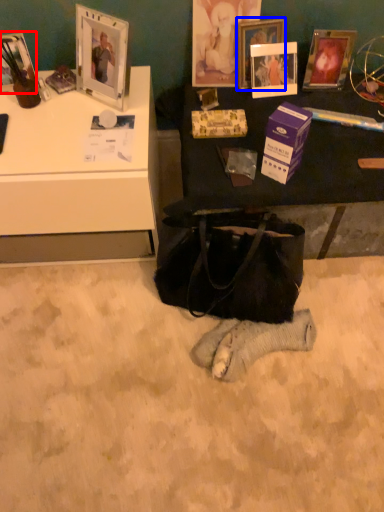
Question: Among these objects, which one is nearest to the camera, picture frame (highlighted by a red box) or picture frame (highlighted by a blue box)?

Choices:
 (A) picture frame
 (B) picture frame

Answer: (A)